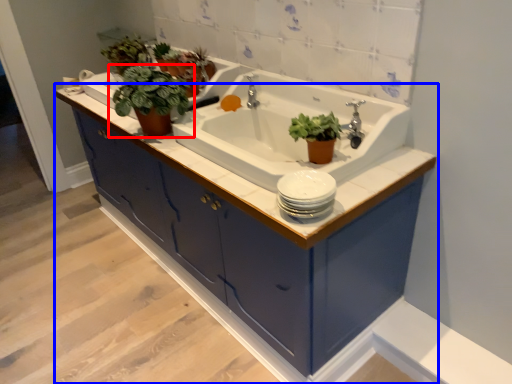
Question: Which object is further to the camera taking this photo, houseplant (highlighted by a red box) or bathroom cabinet (highlighted by a blue box)?

Choices:
 (A) houseplant
 (B) bathroom cabinet

Answer: (A)